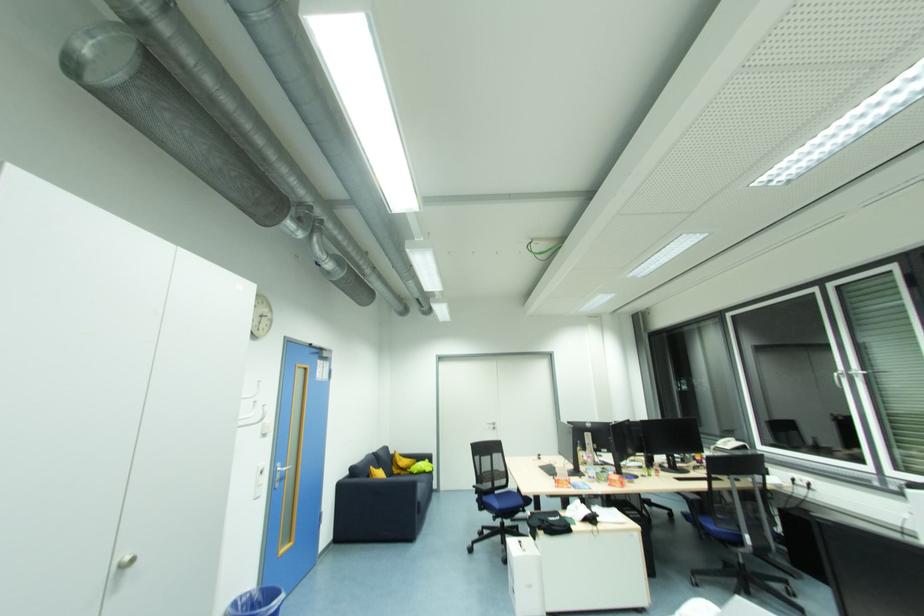
The height and width of the screenshot is (616, 924). Identify the location of blue chair seat. (507, 498).